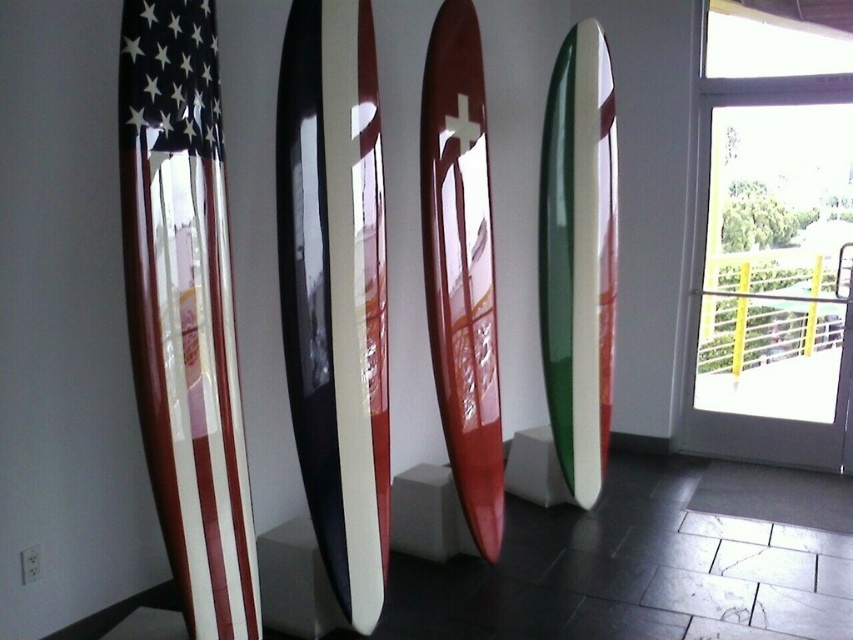
Question: Which object is closer to the camera taking this photo?

Choices:
 (A) shiny metallic flag at left
 (B) white glossy surfboard at center
 (C) shiny red surfboard at center
 (D) green glossy surfboard at center

Answer: (A)

Question: Does shiny metallic flag at left appear over white glossy surfboard at center?

Choices:
 (A) yes
 (B) no

Answer: (B)

Question: Which object appears closest to the camera in this image?

Choices:
 (A) shiny red surfboard at center
 (B) white glossy surfboard at center
 (C) shiny metallic flag at left
 (D) green glossy surfboard at center

Answer: (C)

Question: Can you confirm if shiny red surfboard at center is wider than green glossy surfboard at center?

Choices:
 (A) yes
 (B) no

Answer: (B)

Question: Estimate the real-world distances between objects in this image. Which object is closer to the shiny red surfboard at center?

Choices:
 (A) green glossy surfboard at center
 (B) shiny metallic flag at left
 (C) white glossy surfboard at center

Answer: (C)

Question: Is white glossy surfboard at center below shiny red surfboard at center?

Choices:
 (A) no
 (B) yes

Answer: (B)